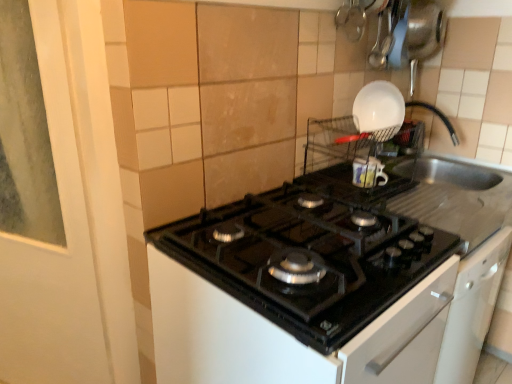
Question: From their relative heights in the image, would you say black glass gas stove at center is taller or shorter than white glossy bowl at upper right?

Choices:
 (A) tall
 (B) short

Answer: (B)

Question: In the image, is black glass gas stove at center on the left side or the right side of white glossy bowl at upper right?

Choices:
 (A) left
 (B) right

Answer: (A)

Question: Is point (215, 269) positioned closer to the camera than point (381, 104)?

Choices:
 (A) farther
 (B) closer

Answer: (B)

Question: From the image's perspective, is white glossy bowl at upper right located above or below black glass gas stove at center?

Choices:
 (A) above
 (B) below

Answer: (A)

Question: Would you say white glossy bowl at upper right is inside or outside black glass gas stove at center?

Choices:
 (A) outside
 (B) inside

Answer: (A)

Question: Would you say white glossy bowl at upper right is to the left or to the right of black glass gas stove at center in the picture?

Choices:
 (A) left
 (B) right

Answer: (B)

Question: In terms of size, does white glossy bowl at upper right appear bigger or smaller than black glass gas stove at center?

Choices:
 (A) big
 (B) small

Answer: (B)